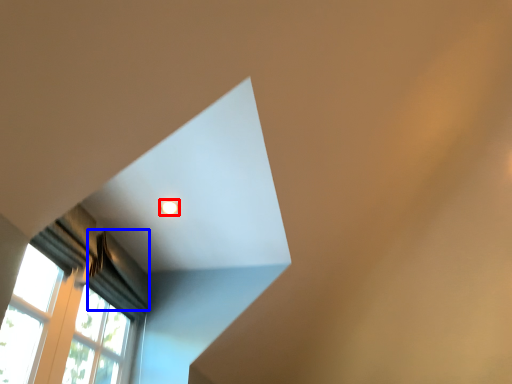
Question: Which object is further to the camera taking this photo, lighting (highlighted by a red box) or curtain (highlighted by a blue box)?

Choices:
 (A) lighting
 (B) curtain

Answer: (A)